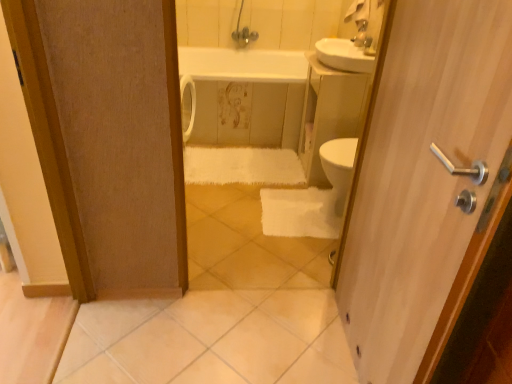
Question: Can you confirm if white glossy bathtub at center is thinner than metallic silver faucet at upper center?

Choices:
 (A) no
 (B) yes

Answer: (A)

Question: Can you confirm if white glossy bathtub at center is taller than metallic silver faucet at upper center?

Choices:
 (A) no
 (B) yes

Answer: (B)

Question: Is white glossy bathtub at center bigger than metallic silver faucet at upper center?

Choices:
 (A) no
 (B) yes

Answer: (B)

Question: Could you tell me if white glossy bathtub at center is turned towards metallic silver faucet at upper center?

Choices:
 (A) no
 (B) yes

Answer: (A)

Question: From the image's perspective, would you say white glossy bathtub at center is positioned over metallic silver faucet at upper center?

Choices:
 (A) yes
 (B) no

Answer: (B)

Question: From the image's perspective, is white glossy bathtub at center located above or below white glossy tile at lower center?

Choices:
 (A) above
 (B) below

Answer: (A)

Question: Does point (194, 140) appear closer or farther from the camera than point (109, 336)?

Choices:
 (A) farther
 (B) closer

Answer: (A)

Question: From a real-world perspective, is white glossy bathtub at center physically located above or below white glossy tile at lower center?

Choices:
 (A) above
 (B) below

Answer: (A)

Question: Based on their sizes in the image, would you say white glossy bathtub at center is bigger or smaller than white glossy tile at lower center?

Choices:
 (A) small
 (B) big

Answer: (B)

Question: Is point (360, 31) closer or farther from the camera than point (439, 92)?

Choices:
 (A) closer
 (B) farther

Answer: (B)

Question: Looking at the image, does metallic silver faucet at upper center seem bigger or smaller compared to wooden door handle at right?

Choices:
 (A) big
 (B) small

Answer: (B)

Question: Visually, is metallic silver faucet at upper center positioned to the left or to the right of wooden door handle at right?

Choices:
 (A) left
 (B) right

Answer: (B)

Question: Relative to wooden door handle at right, is metallic silver faucet at upper center in front or behind?

Choices:
 (A) behind
 (B) front

Answer: (A)

Question: Looking at their shapes, would you say white glossy sink at upper right is wider or thinner than wooden door handle at right?

Choices:
 (A) wide
 (B) thin

Answer: (A)

Question: Is white glossy sink at upper right inside the boundaries of wooden door handle at right, or outside?

Choices:
 (A) outside
 (B) inside

Answer: (A)